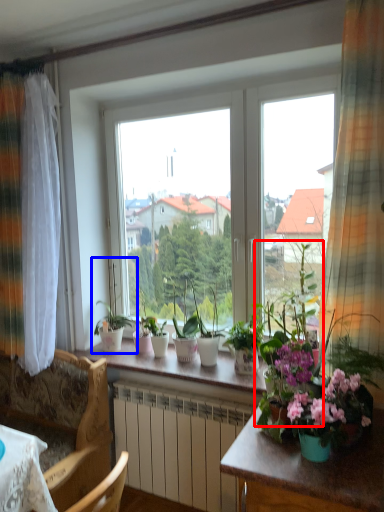
Question: Which of the following is the closest to the observer, houseplant (highlighted by a red box) or houseplant (highlighted by a blue box)?

Choices:
 (A) houseplant
 (B) houseplant

Answer: (A)